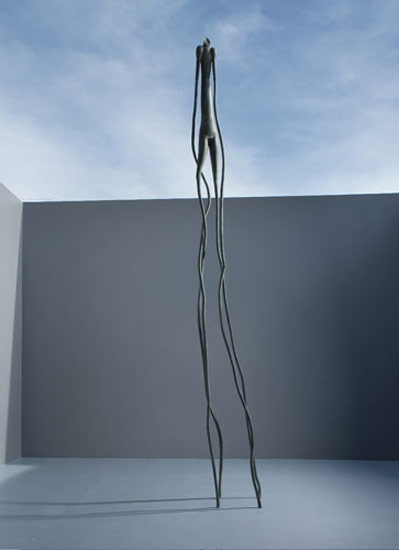
Identify the location of light grey wall. The width and height of the screenshot is (399, 550). (5, 327).